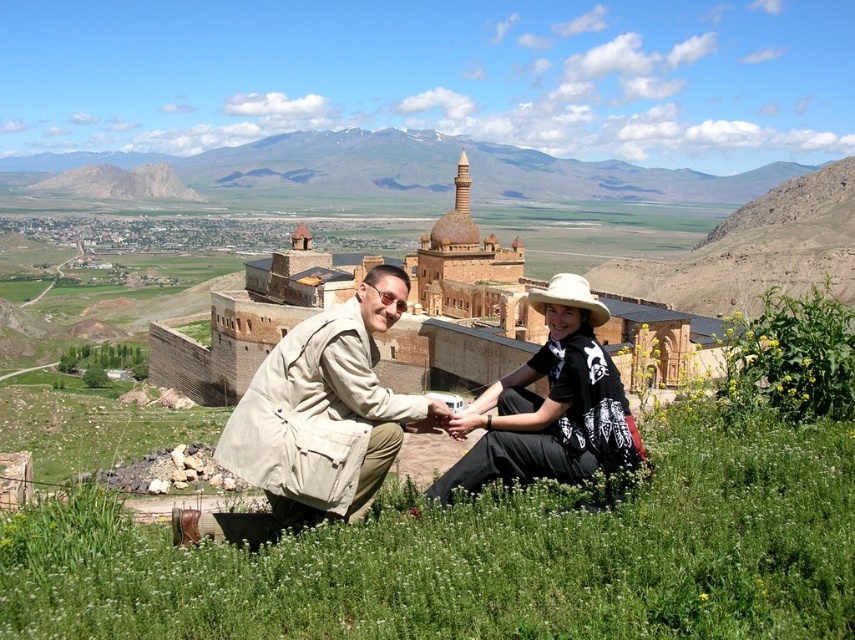
You are a photographer trying to capture a clear shot of the black cotton hat at center without the green grass at lower center blocking it. Is the grass shorter than the hat?

The green grass at lower center is not as tall as the black cotton hat at center, so the grass is shorter than the hat. Therefore, the grass will not block the view of the hat in your photo.

You are a photographer trying to capture a clear shot of both the tan fabric jacket at center and the black cotton hat at center. Since you want both subjects in focus, which one should you adjust your camera focus to prioritize?

The tan fabric jacket at center is closer to the viewer than the black cotton hat at center. To ensure both are in focus, the photographer should focus on the tan fabric jacket at center and use a smaller aperture for a deeper depth of field.